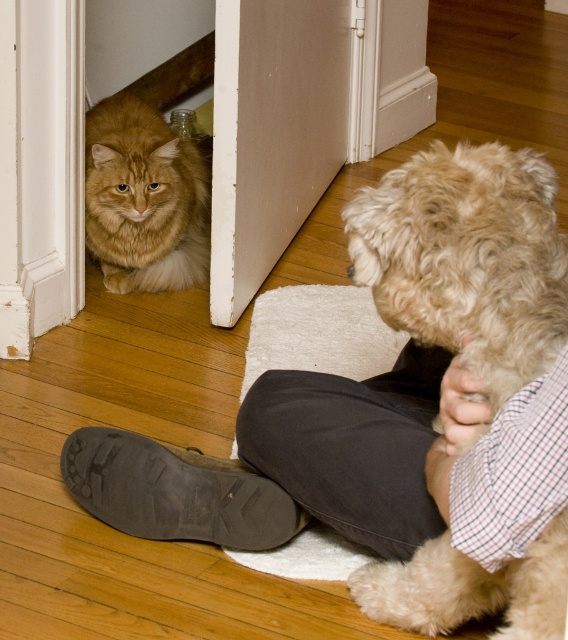
Can you confirm if fluffy beige dog at lower right is positioned to the left of brown suede shoe at lower center?

In fact, fluffy beige dog at lower right is to the right of brown suede shoe at lower center.

Measure the distance between fluffy beige dog at lower right and camera.

fluffy beige dog at lower right is 3.60 feet from camera.

Which is behind, point (483, 198) or point (94, 440)?

Point (94, 440)

Where is `fluffy beige dog at lower right`? fluffy beige dog at lower right is located at coordinates (467, 259).

Between fluffy beige dog at lower right and golden fur cat at lower left, which one is positioned higher?

Positioned higher is golden fur cat at lower left.

Between fluffy beige dog at lower right and golden fur cat at lower left, which one is positioned lower?

fluffy beige dog at lower right

Is point (348, 243) closer to camera compared to point (133, 134)?

Yes, it is in front of point (133, 134).

Identify the location of fluffy beige dog at lower right. The image size is (568, 640). (467, 259).

This screenshot has height=640, width=568. What do you see at coordinates (144, 198) in the screenshot?
I see `golden fur cat at lower left` at bounding box center [144, 198].

Between point (85, 180) and point (202, 467), which one is positioned behind?

Point (85, 180)

Is point (90, 168) farther from camera compared to point (156, 464)?

Yes, it is behind point (156, 464).

Identify the location of golden fur cat at lower left. This screenshot has width=568, height=640. (144, 198).